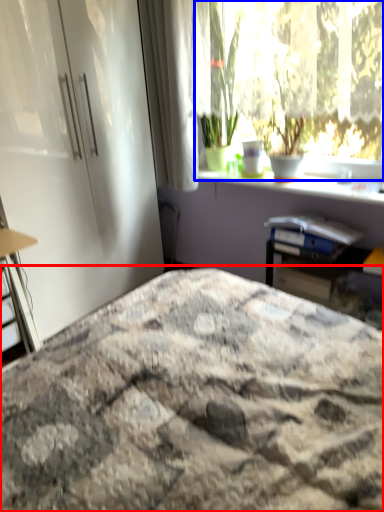
Question: Which point is closer to the camera, bed (highlighted by a red box) or window (highlighted by a blue box)?

Choices:
 (A) bed
 (B) window

Answer: (A)